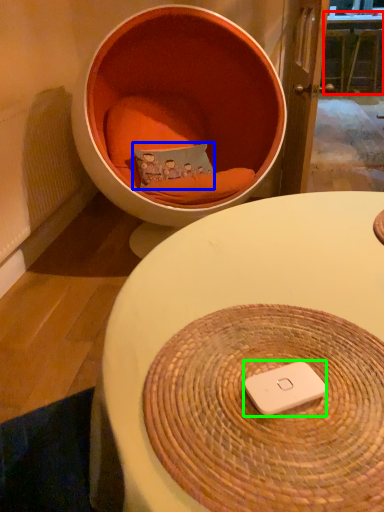
Question: Estimate the real-world distances between objects in this image. Which object is farther from table (highlighted by a red box), pillow (highlighted by a blue box) or ipod (highlighted by a green box)?

Choices:
 (A) pillow
 (B) ipod

Answer: (B)